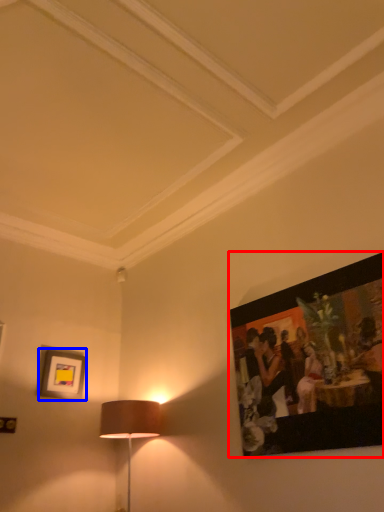
Question: Which object is closer to the camera taking this photo, picture frame (highlighted by a red box) or picture frame (highlighted by a blue box)?

Choices:
 (A) picture frame
 (B) picture frame

Answer: (A)